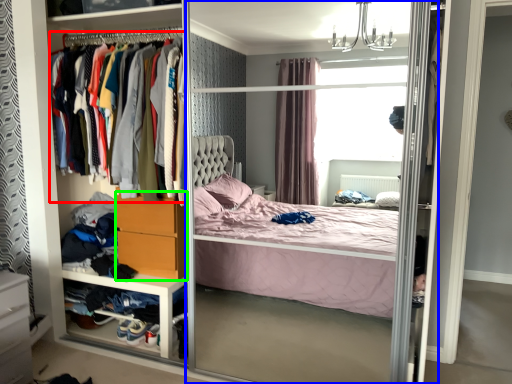
Question: Which object is the farthest from clothing (highlighted by a red box)? Choose among these: screen door (highlighted by a blue box) or dresser (highlighted by a green box).

Choices:
 (A) screen door
 (B) dresser

Answer: (A)